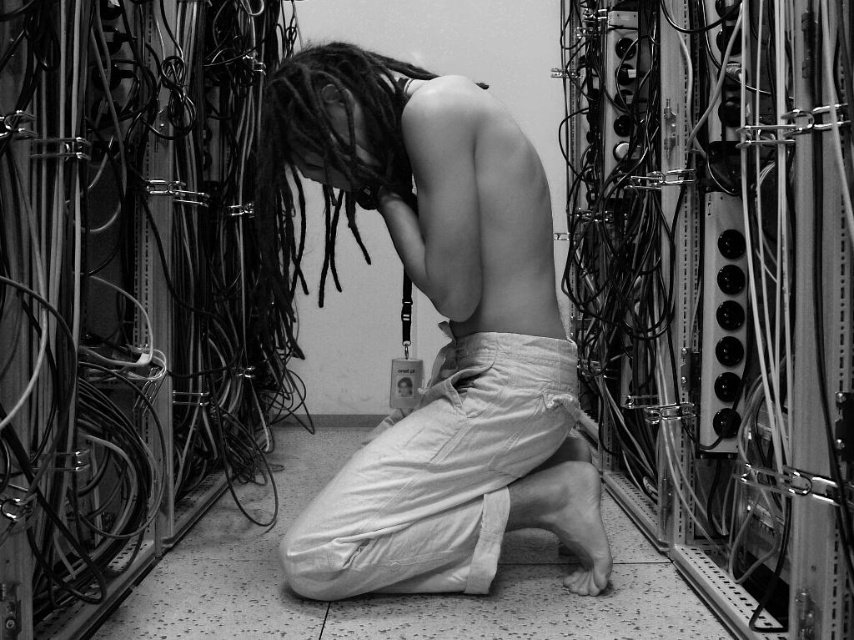
Based on the photo, you are a photographer adjusting your camera settings to capture the scene. You notice two points marked in the image at coordinates point (565, 460) and point (483, 195). Which of these points is closer to your camera lens?

Point (483, 195) is closer to the camera lens because it is less further than point (565, 460) according to the description.

You are a photographer analyzing this black and white photo. You notice a point at coordinates [442,330]. What object is located at that point?

The point at coordinates [442,330] corresponds to the matte white pants at center.

You are a photographer who needs to adjust the lighting in the scene. You have a flashlight that can only illuminate objects within a 3.5 inch radius. If you position the flashlight exactly between the matte white pants at center and the smooth skin at back, will both objects be fully illuminated?

The distance between the matte white pants at center and the smooth skin at back is 3.30 inches. Since the flashlight has a 3.5 inch radius, positioning it exactly between them would place each object within the 3.5 inch range. Therefore, both objects will be fully illuminated.